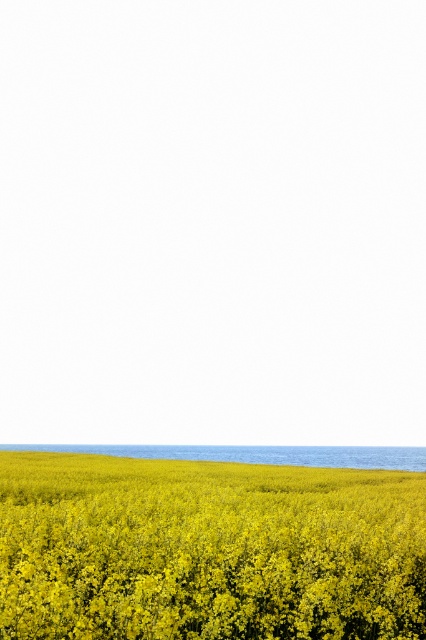
Question: Which point appears farthest from the camera in this image?

Choices:
 (A) (181, 458)
 (B) (293, 595)

Answer: (A)

Question: Among these points, which one is farthest from the camera?

Choices:
 (A) (14, 445)
 (B) (285, 506)

Answer: (A)

Question: Does yellow matte flower at bottom appear under blue smooth water at bottom?

Choices:
 (A) yes
 (B) no

Answer: (B)

Question: Can you confirm if yellow matte flower at bottom is thinner than blue smooth water at bottom?

Choices:
 (A) no
 (B) yes

Answer: (B)

Question: Which point is closer to the camera?

Choices:
 (A) (43, 563)
 (B) (117, 451)

Answer: (A)

Question: Can you confirm if yellow matte flower at bottom is positioned to the left of blue smooth water at bottom?

Choices:
 (A) no
 (B) yes

Answer: (A)